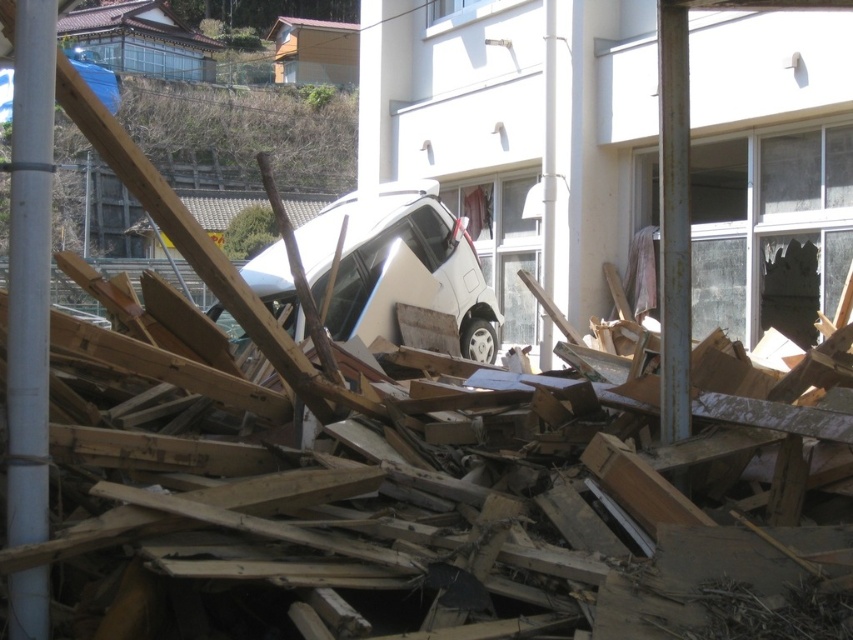
Is white matte car at center wider than white matte van at center?

Incorrect, white matte car at center's width does not surpass white matte van at center's.

Can you confirm if white matte car at center is shorter than white matte van at center?

Indeed, white matte car at center has a lesser height compared to white matte van at center.

Which is in front, point (486, 285) or point (0, 97)?

Point (486, 285)

The width and height of the screenshot is (853, 640). Find the location of `white matte car at center`. white matte car at center is located at coordinates (398, 266).

Which is above, white matte car at center or white smooth pipe at center left?

Positioned higher is white matte car at center.

This screenshot has height=640, width=853. In order to click on white matte car at center in this screenshot , I will do `click(398, 266)`.

Is point (20, 406) closer to viewer compared to point (1, 90)?

That is True.

Where is `white smooth pipe at center left`? The width and height of the screenshot is (853, 640). white smooth pipe at center left is located at coordinates (28, 264).